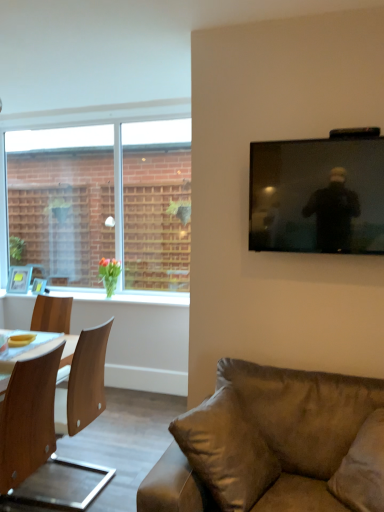
Question: From a real-world perspective, is black glossy tv at upper right beneath green glossy vase at left?

Choices:
 (A) no
 (B) yes

Answer: (A)

Question: Is black glossy tv at upper right taller than green glossy vase at left?

Choices:
 (A) no
 (B) yes

Answer: (B)

Question: Does black glossy tv at upper right have a greater width compared to green glossy vase at left?

Choices:
 (A) no
 (B) yes

Answer: (A)

Question: Can you confirm if black glossy tv at upper right is positioned to the right of green glossy vase at left?

Choices:
 (A) no
 (B) yes

Answer: (B)

Question: Is black glossy tv at upper right smaller than green glossy vase at left?

Choices:
 (A) yes
 (B) no

Answer: (B)

Question: Is brown leather couch at lower right taller or shorter than wooden chair at left?

Choices:
 (A) tall
 (B) short

Answer: (B)

Question: Is brown leather couch at lower right bigger or smaller than wooden chair at left?

Choices:
 (A) big
 (B) small

Answer: (A)

Question: From the image's perspective, is brown leather couch at lower right positioned above or below wooden chair at left?

Choices:
 (A) below
 (B) above

Answer: (A)

Question: Looking at their shapes, would you say brown leather couch at lower right is wider or thinner than wooden chair at left?

Choices:
 (A) wide
 (B) thin

Answer: (A)

Question: Visually, is suede-like beige pillow at lower right, marked as the first pillow in a right-to-left arrangement, positioned to the left or to the right of wooden chair at left?

Choices:
 (A) right
 (B) left

Answer: (A)

Question: From the image's perspective, is suede-like beige pillow at lower right, which ranks as the 2th pillow in left-to-right order, positioned above or below wooden chair at left?

Choices:
 (A) above
 (B) below

Answer: (A)

Question: Is suede-like beige pillow at lower right, marked as the first pillow in a right-to-left arrangement, in front of or behind wooden chair at left in the image?

Choices:
 (A) behind
 (B) front

Answer: (B)

Question: Considering the positions of suede-like beige pillow at lower right, marked as the first pillow in a right-to-left arrangement, and wooden chair at left in the image, is suede-like beige pillow at lower right, marked as the first pillow in a right-to-left arrangement, bigger or smaller than wooden chair at left?

Choices:
 (A) big
 (B) small

Answer: (B)

Question: Is point (76, 462) closer or farther from the camera than point (100, 268)?

Choices:
 (A) farther
 (B) closer

Answer: (B)

Question: Which is correct: wooden chair at left is inside green glossy vase at left, or outside of it?

Choices:
 (A) inside
 (B) outside

Answer: (B)